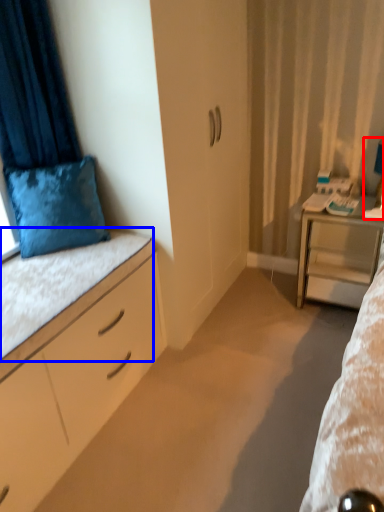
Question: Which point is closer to the camera, table lamp (highlighted by a red box) or ledge (highlighted by a blue box)?

Choices:
 (A) table lamp
 (B) ledge

Answer: (B)